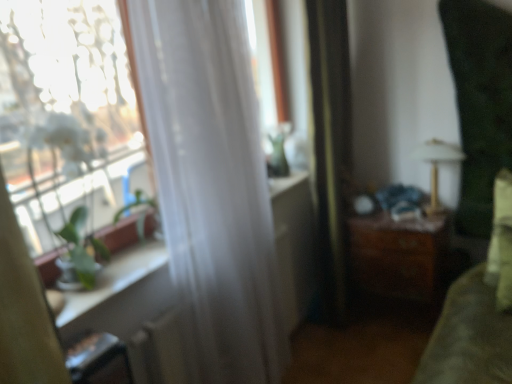
Question: Is transparent glass window at left a part of white sheer curtain at left?

Choices:
 (A) no
 (B) yes

Answer: (A)

Question: Would you say white sheer curtain at left is outside transparent glass window at left?

Choices:
 (A) no
 (B) yes

Answer: (B)

Question: Does white sheer curtain at left have a larger size compared to transparent glass window at left?

Choices:
 (A) no
 (B) yes

Answer: (A)

Question: Are white sheer curtain at left and transparent glass window at left making contact?

Choices:
 (A) no
 (B) yes

Answer: (A)

Question: From a real-world perspective, is white sheer curtain at left located higher than transparent glass window at left?

Choices:
 (A) yes
 (B) no

Answer: (B)

Question: Does white sheer curtain at left come in front of transparent glass window at left?

Choices:
 (A) yes
 (B) no

Answer: (B)

Question: Is white sheer curtain at left, marked as the first curtain in a left-to-right arrangement, facing away from silky black curtain at center, positioned as the second curtain in left-to-right order?

Choices:
 (A) no
 (B) yes

Answer: (A)

Question: Considering the relative sizes of white sheer curtain at left, positioned as the 2th curtain in right-to-left order, and silky black curtain at center, the first curtain in the right-to-left sequence, in the image provided, is white sheer curtain at left, positioned as the 2th curtain in right-to-left order, shorter than silky black curtain at center, the first curtain in the right-to-left sequence,?

Choices:
 (A) no
 (B) yes

Answer: (B)

Question: Is white sheer curtain at left, marked as the first curtain in a left-to-right arrangement, not near silky black curtain at center, positioned as the second curtain in left-to-right order?

Choices:
 (A) yes
 (B) no

Answer: (B)

Question: From a real-world perspective, is white sheer curtain at left, positioned as the 2th curtain in right-to-left order, on silky black curtain at center, positioned as the second curtain in left-to-right order?

Choices:
 (A) yes
 (B) no

Answer: (A)

Question: Considering the relative positions of white sheer curtain at left, positioned as the 2th curtain in right-to-left order, and silky black curtain at center, the first curtain in the right-to-left sequence, in the image provided, is white sheer curtain at left, positioned as the 2th curtain in right-to-left order, behind silky black curtain at center, the first curtain in the right-to-left sequence,?

Choices:
 (A) no
 (B) yes

Answer: (A)

Question: Is white sheer curtain at left, positioned as the 2th curtain in right-to-left order, wider than silky black curtain at center, the first curtain in the right-to-left sequence?

Choices:
 (A) yes
 (B) no

Answer: (A)

Question: Considering the relative sizes of metallic gold lamp at upper right and wooden chest of drawers at center-right in the image provided, is metallic gold lamp at upper right smaller than wooden chest of drawers at center-right?

Choices:
 (A) no
 (B) yes

Answer: (B)